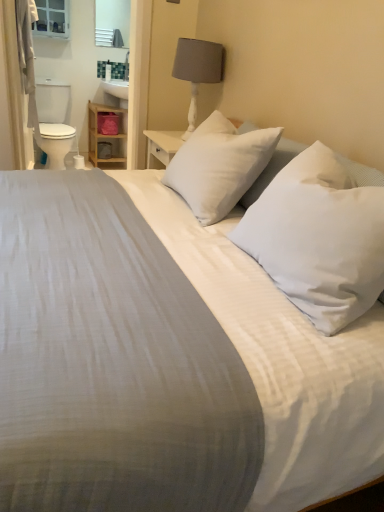
Question: Is matte gray fabric lampshade at upper center taller or shorter than white soft pillow at center, the second pillow when ordered from back to front?

Choices:
 (A) short
 (B) tall

Answer: (B)

Question: Is matte gray fabric lampshade at upper center inside or outside of white soft pillow at center, the second pillow when ordered from back to front?

Choices:
 (A) outside
 (B) inside

Answer: (A)

Question: Which is nearer to the wooden shelf at left?

Choices:
 (A) white fabric curtain at left
 (B) white soft pillow at center, the second pillow when ordered from back to front
 (C) white glossy mirror at upper center
 (D) matte gray fabric lampshade at upper center
 (E) white soft pillow at center, the 1th pillow in the back-to-front sequence

Answer: (C)

Question: Which of these objects is positioned farthest from the matte white medicine cabinet at upper left?

Choices:
 (A) white soft pillow at center, placed as the first pillow when sorted from front to back
 (B) white fabric curtain at left
 (C) white glossy toilet bowl at left
 (D) white soft pillow at center, which is the second pillow from front to back
 (E) wooden shelf at left

Answer: (A)